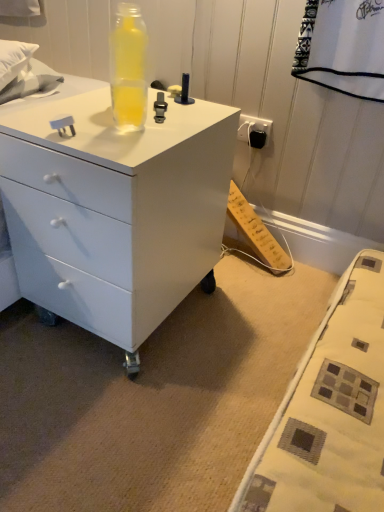
Question: Is white glossy chest of drawers at center bigger or smaller than transparent plastic bottle at upper center?

Choices:
 (A) big
 (B) small

Answer: (A)

Question: Considering the relative positions of white glossy chest of drawers at center and transparent plastic bottle at upper center in the image provided, is white glossy chest of drawers at center to the left or to the right of transparent plastic bottle at upper center?

Choices:
 (A) right
 (B) left

Answer: (B)

Question: Is white glossy chest of drawers at center inside or outside of transparent plastic bottle at upper center?

Choices:
 (A) outside
 (B) inside

Answer: (A)

Question: From a real-world perspective, relative to white glossy chest of drawers at center, is transparent plastic bottle at upper center vertically above or below?

Choices:
 (A) above
 (B) below

Answer: (A)

Question: Considering the positions of transparent plastic bottle at upper center and white glossy chest of drawers at center in the image, is transparent plastic bottle at upper center taller or shorter than white glossy chest of drawers at center?

Choices:
 (A) tall
 (B) short

Answer: (B)

Question: Considering the positions of transparent plastic bottle at upper center and white glossy chest of drawers at center in the image, is transparent plastic bottle at upper center bigger or smaller than white glossy chest of drawers at center?

Choices:
 (A) small
 (B) big

Answer: (A)

Question: From the image's perspective, relative to white glossy chest of drawers at center, is transparent plastic bottle at upper center above or below?

Choices:
 (A) above
 (B) below

Answer: (A)